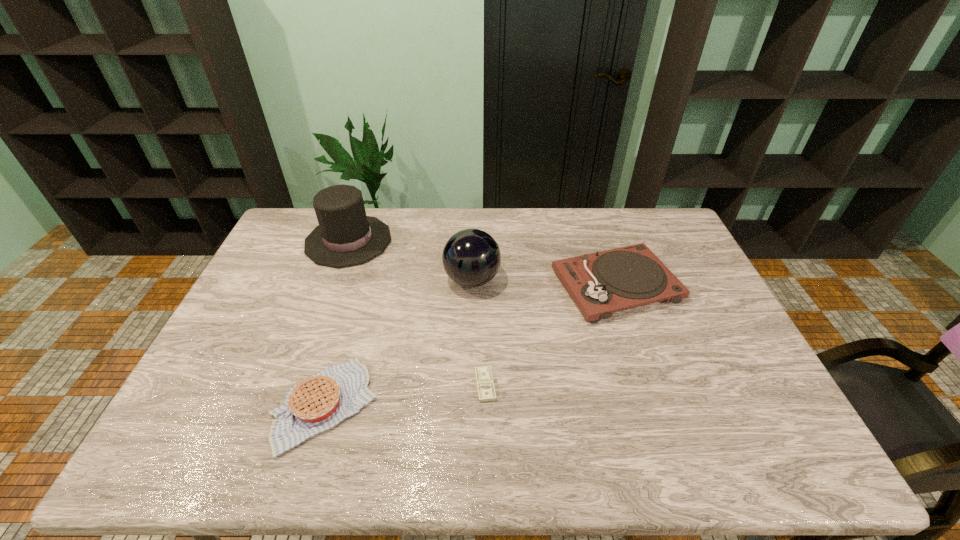
Identify the location of dress hat. (346, 236).

Identify the location of bowling ball. The height and width of the screenshot is (540, 960). (471, 258).

Find the location of a particular element. the rightmost object is located at coordinates (601, 283).

Identify the location of phonograph_record. (601, 283).

The height and width of the screenshot is (540, 960). Find the location of `the fourth tallest object`. the fourth tallest object is located at coordinates (321, 401).

Find the location of a particular element. money is located at coordinates (485, 385).

Find the location of `vacant space located 0.090m on the front of the dress hat with the decoration`. vacant space located 0.090m on the front of the dress hat with the decoration is located at coordinates (417, 241).

Image resolution: width=960 pixels, height=540 pixels. I want to click on blank area located on the side of the bowling ball with the finger holes, so click(x=525, y=280).

Find the location of a particular element. The height and width of the screenshot is (540, 960). vacant point located 0.240m on the left of the phonograph_record is located at coordinates (479, 285).

The width and height of the screenshot is (960, 540). What are the coordinates of `vacant area situated on the left of the pie` in the screenshot? It's located at (204, 405).